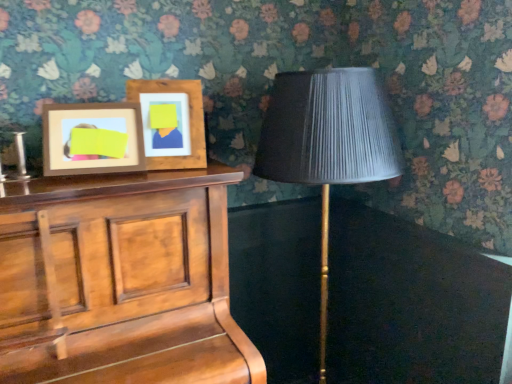
Question: Can we say matte black lampshade at right lies outside wooden piano at left?

Choices:
 (A) no
 (B) yes

Answer: (B)

Question: Considering the relative sizes of matte black lampshade at right and wooden piano at left in the image provided, is matte black lampshade at right wider than wooden piano at left?

Choices:
 (A) no
 (B) yes

Answer: (A)

Question: Is the position of matte black lampshade at right more distant than that of wooden piano at left?

Choices:
 (A) yes
 (B) no

Answer: (A)

Question: From the image's perspective, would you say matte black lampshade at right is shown under wooden piano at left?

Choices:
 (A) no
 (B) yes

Answer: (A)

Question: Is the surface of matte black lampshade at right in direct contact with wooden piano at left?

Choices:
 (A) no
 (B) yes

Answer: (A)

Question: From the image's perspective, is matte black lampshade at right on wooden piano at left?

Choices:
 (A) no
 (B) yes

Answer: (B)

Question: Does matte black lampshade at right turn towards wooden picture frame at upper left, placed as the 1th picture frame when sorted from right to left?

Choices:
 (A) no
 (B) yes

Answer: (A)

Question: Does matte black lampshade at right come behind wooden picture frame at upper left, which ranks as the 2th picture frame in left-to-right order?

Choices:
 (A) no
 (B) yes

Answer: (A)

Question: Is matte black lampshade at right wider than wooden picture frame at upper left, placed as the 1th picture frame when sorted from right to left?

Choices:
 (A) yes
 (B) no

Answer: (A)

Question: Is matte black lampshade at right at the left side of wooden picture frame at upper left, placed as the 1th picture frame when sorted from right to left?

Choices:
 (A) no
 (B) yes

Answer: (A)

Question: Is matte black lampshade at right beside wooden picture frame at upper left, placed as the 1th picture frame when sorted from right to left?

Choices:
 (A) yes
 (B) no

Answer: (B)

Question: From the image's perspective, does matte black lampshade at right appear higher than wooden picture frame at upper left, placed as the 1th picture frame when sorted from right to left?

Choices:
 (A) no
 (B) yes

Answer: (A)

Question: From the image's perspective, is wooden picture frame at upper left, the first picture frame positioned from the left, on top of wooden picture frame at upper left, which ranks as the 2th picture frame in left-to-right order?

Choices:
 (A) yes
 (B) no

Answer: (B)